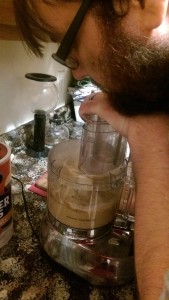
Locate an element on the screen. countertop is located at coordinates (126, 296), (31, 282), (18, 241), (30, 159).